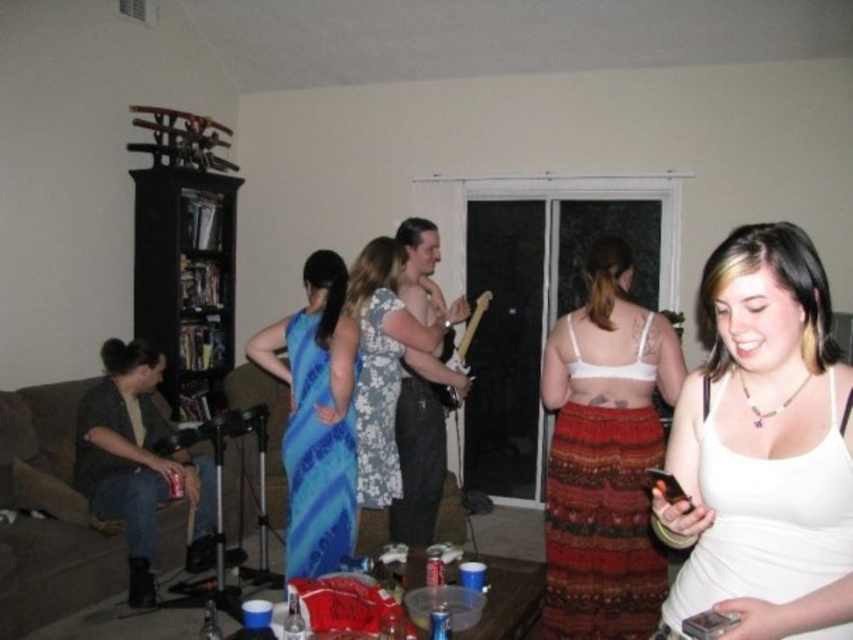
Who is shorter, floral dress at center or floral-patterned fabric dress at center?

floral-patterned fabric dress at center

Which is behind, point (381, 240) or point (367, 476)?

The point (381, 240) is behind.

Does point (390, 424) come farther from viewer compared to point (380, 461)?

That is True.

Where is `floral dress at center`? The height and width of the screenshot is (640, 853). floral dress at center is located at coordinates (387, 372).

Between white tank top at center and floral dress at center, which one appears on the left side from the viewer's perspective?

floral dress at center

Between white tank top at center and floral dress at center, which one has less height?

floral dress at center

Is point (595, 301) more distant than point (395, 538)?

No, (595, 301) is closer to viewer.

Where is `white tank top at center`? white tank top at center is located at coordinates (605, 456).

This screenshot has height=640, width=853. What do you see at coordinates (763, 449) in the screenshot? I see `white matte tank top at center` at bounding box center [763, 449].

Does white matte tank top at center have a greater width compared to blue satin dress at center?

Yes, white matte tank top at center is wider than blue satin dress at center.

This screenshot has height=640, width=853. What do you see at coordinates (763, 449) in the screenshot?
I see `white matte tank top at center` at bounding box center [763, 449].

Image resolution: width=853 pixels, height=640 pixels. In order to click on white matte tank top at center in this screenshot , I will do `click(763, 449)`.